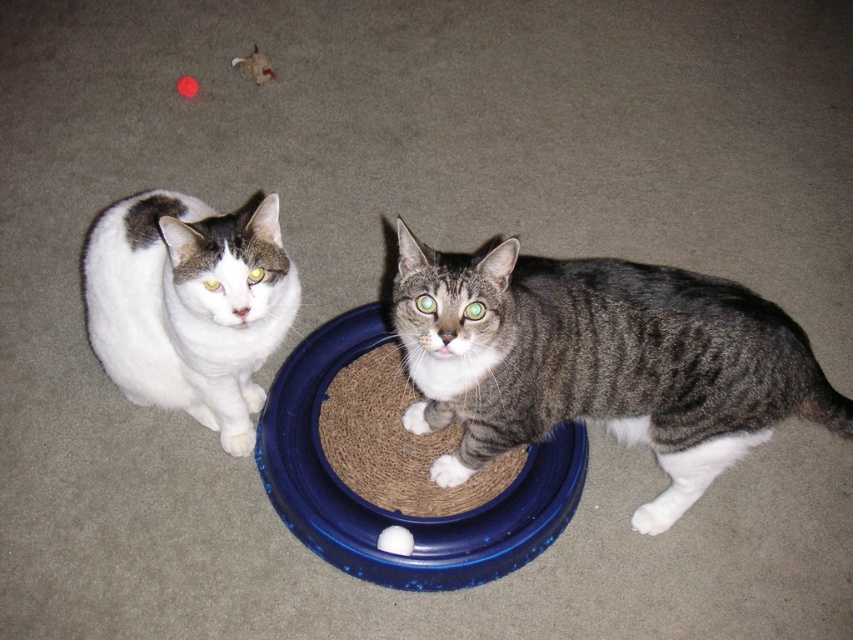
Question: Does gray tabby cat at center appear on the left side of white fur cat at left?

Choices:
 (A) yes
 (B) no

Answer: (B)

Question: Does gray tabby cat at center have a smaller size compared to white fur cat at left?

Choices:
 (A) yes
 (B) no

Answer: (B)

Question: Can you confirm if gray tabby cat at center is thinner than white fur cat at left?

Choices:
 (A) no
 (B) yes

Answer: (A)

Question: Which object is closer to the camera taking this photo?

Choices:
 (A) white fur cat at left
 (B) gray tabby cat at center

Answer: (B)